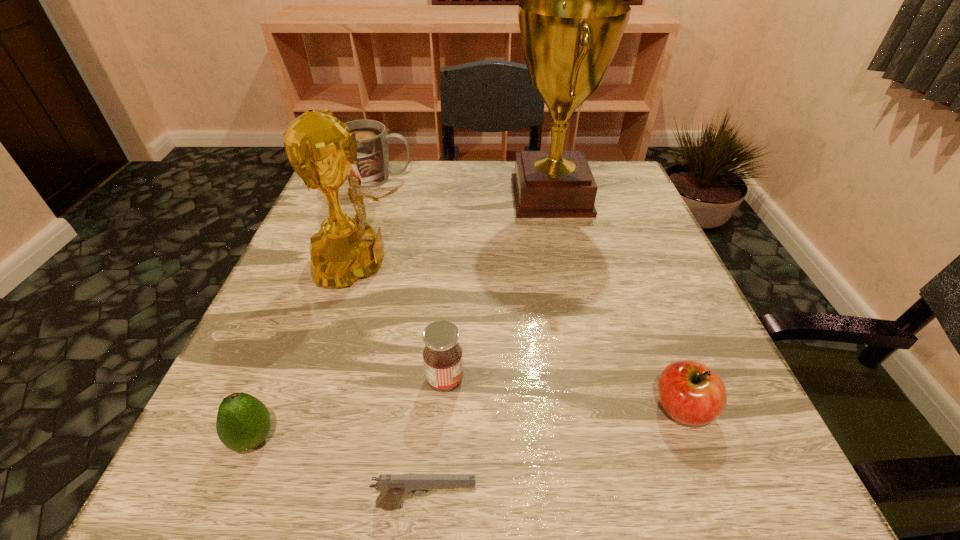
At what (x,y) coordinates should I click in order to perform the action: click on blank region between the taller award and the nearest object. Please return your answer as a coordinate pair (x, y). This screenshot has height=540, width=960. Looking at the image, I should click on (489, 351).

This screenshot has width=960, height=540. In order to click on vacant area that lies between the tallest object and the jam in this screenshot , I will do `click(498, 288)`.

The width and height of the screenshot is (960, 540). I want to click on free space between the apple and the mug, so click(531, 293).

You are a GUI agent. You are given a task and a screenshot of the screen. Output one action in this format:
    pyautogui.click(x=<x>, y=<y>)
    Task: Click on the empty space between the jam and the nearest object
    Image resolution: width=960 pixels, height=540 pixels.
    Given the screenshot: What is the action you would take?
    pyautogui.click(x=436, y=442)

Find the location of a particular element. The width and height of the screenshot is (960, 540). vacant area that lies between the jam and the avocado is located at coordinates (349, 409).

The width and height of the screenshot is (960, 540). Find the location of `unoccupied position between the mug and the pistol`. unoccupied position between the mug and the pistol is located at coordinates (403, 342).

Select which object is the second closest to the shorter award. Please provide its 2D coordinates. Your answer should be formatted as a tuple, i.e. [(x, y)], where the tuple contains the x and y coordinates of a point satisfying the conditions above.

[(372, 169)]

Choose which object is the sixth nearest neighbor to the pistol. Please provide its 2D coordinates. Your answer should be formatted as a tuple, i.e. [(x, y)], where the tuple contains the x and y coordinates of a point satisfying the conditions above.

[(372, 169)]

At what (x,y) coordinates should I click in order to perform the action: click on free region that satisfies the following two spatial constraints: 1. on the plaque of the tallest object; 2. on the front side of the avocado. Please return your answer as a coordinate pair (x, y). This screenshot has width=960, height=540. Looking at the image, I should click on (605, 438).

Locate an element on the screen. vacant area in the image that satisfies the following two spatial constraints: 1. on the label side of the jam; 2. on the right side of the apple is located at coordinates (443, 408).